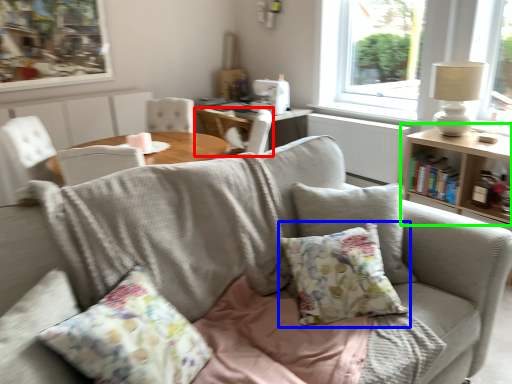
Question: Estimate the real-world distances between objects in this image. Which object is closer to chair (highlighted by a red box), pillow (highlighted by a blue box) or table (highlighted by a green box)?

Choices:
 (A) pillow
 (B) table

Answer: (B)